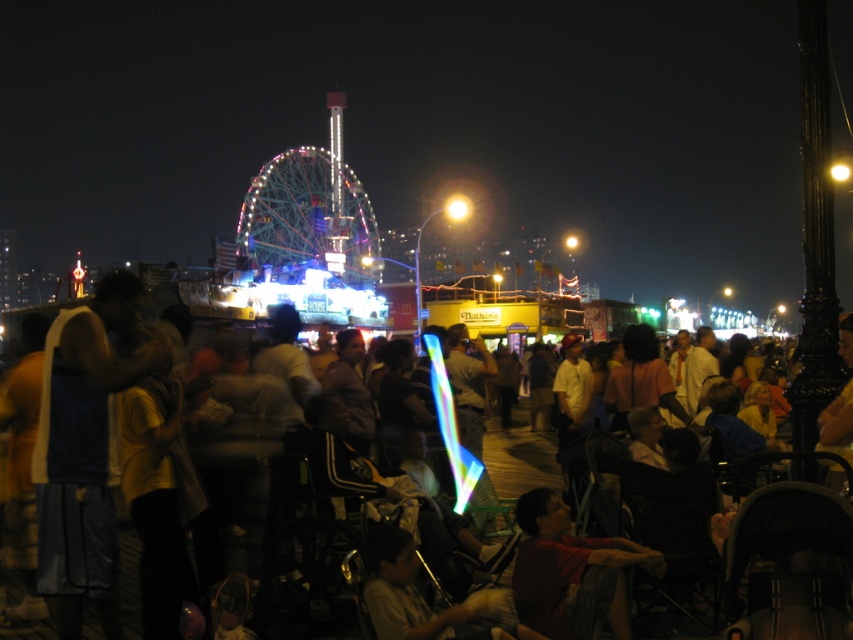
You are at the fair and want to take a photo of the multicolored metallic ferris wheel at center and the red shirt at lower right in the same frame. Based on their positions, will the ferris wheel appear higher up in the photo compared to the red shirt?

Yes, the multicolored metallic ferris wheel at center is located above the red shirt at lower right, so it will appear higher up in the photo.

You are standing at the point marked as point (306, 218). What object is located exactly at that point?

The multicolored metallic Ferris wheel at center is located exactly at point (306, 218).